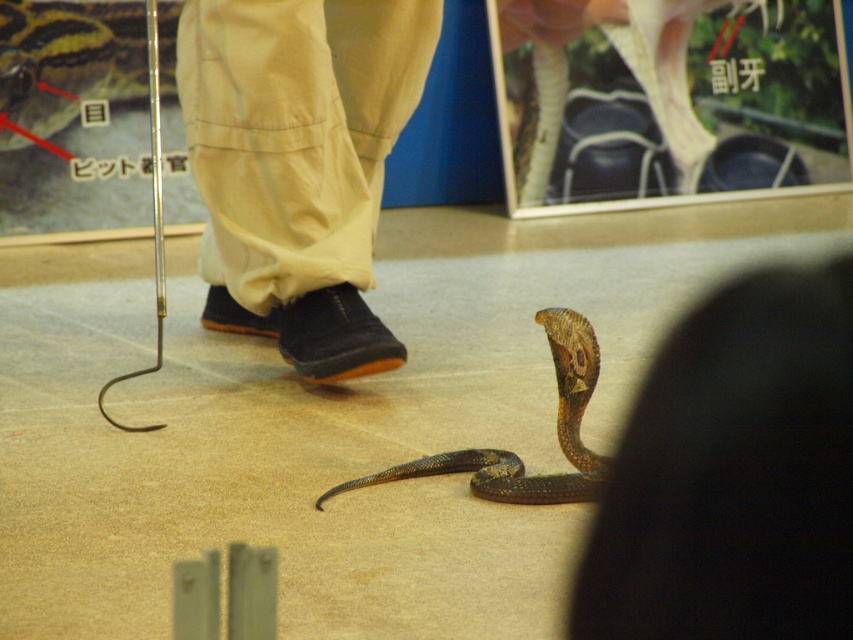
You are a zookeeper who needs to feed the matte brown snake at lower center. You have a feeding tool that can extend up to 60 centimeters. Can you safely reach the snake with your tool?

The matte brown snake at lower center is 63.08 centimeters away from the camera, which is beyond the 60 centimeter reach of your feeding tool. Therefore, you cannot safely reach the snake with your current tool.

You are a zookeeper tasked with moving the shiny black snake at center to a new enclosure. The enclosure entrance is at point 0.1, 0.08. Can you safely place the snake there?

The shiny black snake at center is located at point (65, 61), which is very close to the enclosure entrance at (67, 64). Therefore, the snake can be safely placed there.